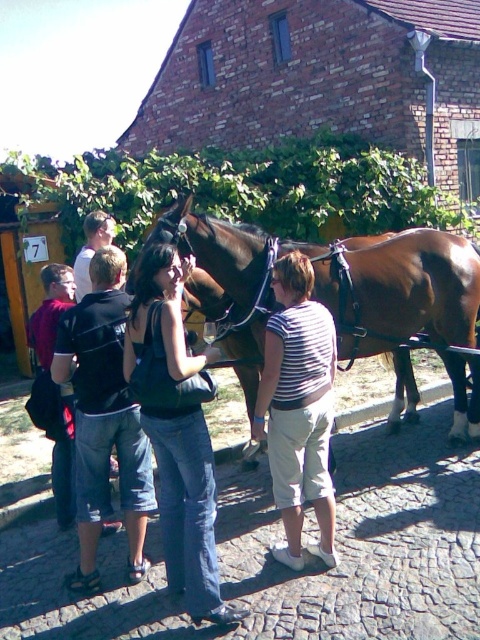
Between brown glossy horse at center and black cotton shirt at center, which one is positioned lower?

black cotton shirt at center is lower down.

Is brown glossy horse at center bigger than black cotton shirt at center?

Yes, brown glossy horse at center is bigger than black cotton shirt at center.

Where is `brown glossy horse at center`? The image size is (480, 640). brown glossy horse at center is located at coordinates (338, 282).

Locate an element on the screen. brown glossy horse at center is located at coordinates (338, 282).

Is denim jeans at center wider than striped fabric shirt at center?

Yes, denim jeans at center is wider than striped fabric shirt at center.

Which is above, denim jeans at center or striped fabric shirt at center?

striped fabric shirt at center

This screenshot has height=640, width=480. I want to click on denim jeans at center, so click(x=177, y=433).

Locate an element on the screen. The width and height of the screenshot is (480, 640). denim jeans at center is located at coordinates (177, 433).

Between point (166, 330) and point (109, 256), which one is positioned in front?

Point (166, 330) is in front.

Does point (171, 432) come closer to viewer compared to point (83, 468)?

Yes.

Where is `denim jeans at center`? The height and width of the screenshot is (640, 480). denim jeans at center is located at coordinates (177, 433).

Where is `denim jeans at center`? Image resolution: width=480 pixels, height=640 pixels. denim jeans at center is located at coordinates (177, 433).